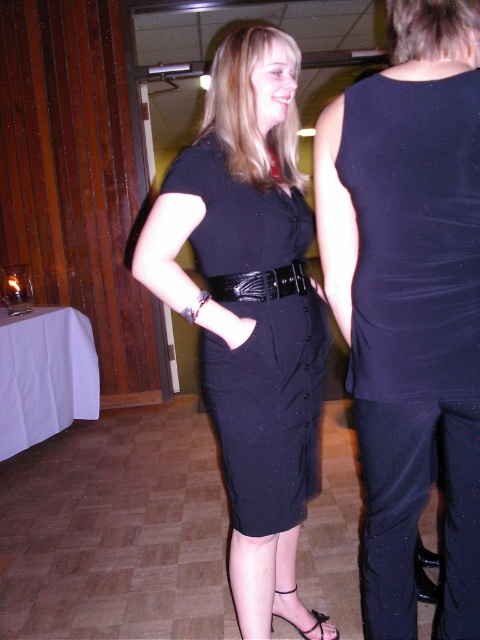
Can you confirm if black satin dress at center is taller than black matte dress at center?

Incorrect, black satin dress at center's height is not larger of black matte dress at center's.

Which is behind, point (422, 404) or point (313, 397)?

Positioned behind is point (313, 397).

Find the location of a particular element. The width and height of the screenshot is (480, 640). black satin dress at center is located at coordinates (409, 298).

Is point (475, 136) closer to viewer compared to point (309, 637)?

That is True.

Is black satin dress at center positioned before black leather sandal at lower center?

That is True.

Does point (372, 189) come behind point (314, 618)?

No, it is in front of (314, 618).

You are a GUI agent. You are given a task and a screenshot of the screen. Output one action in this format:
    pyautogui.click(x=<x>, y=<y>)
    Task: Click on the black satin dress at center
    The image size is (480, 640).
    Given the screenshot: What is the action you would take?
    [x=409, y=298]

Which is more to the right, black matte dress at center or black leather sandal at lower center?

From the viewer's perspective, black leather sandal at lower center appears more on the right side.

I want to click on black matte dress at center, so (249, 308).